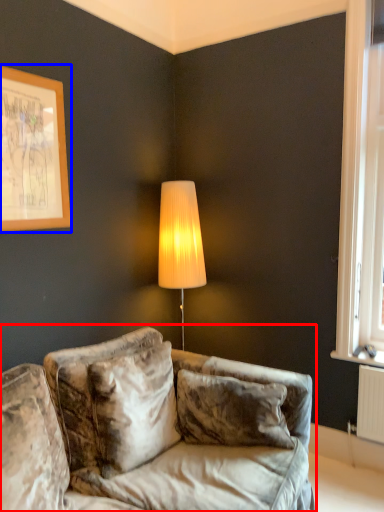
Question: Which of the following is the farthest to the observer, studio couch (highlighted by a red box) or picture frame (highlighted by a blue box)?

Choices:
 (A) studio couch
 (B) picture frame

Answer: (B)